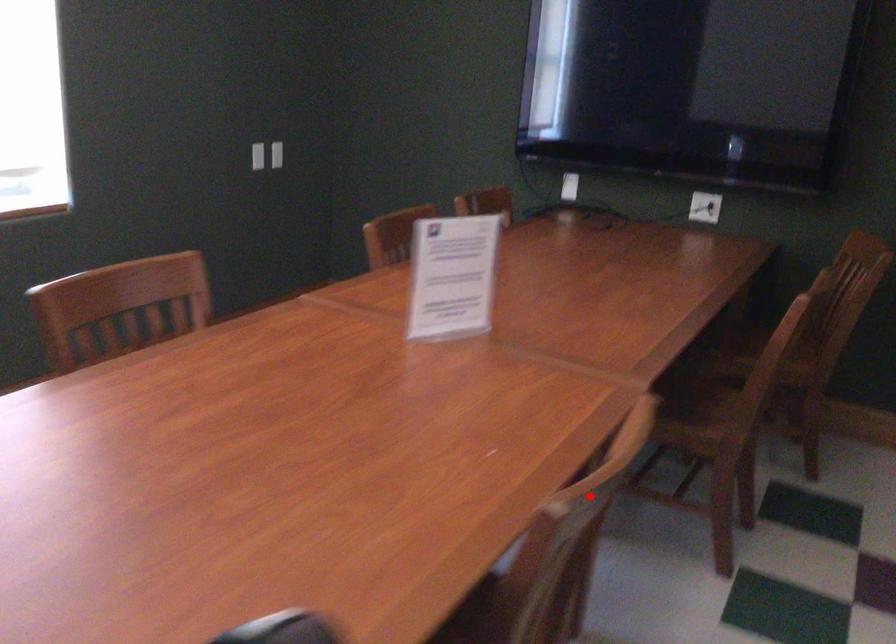
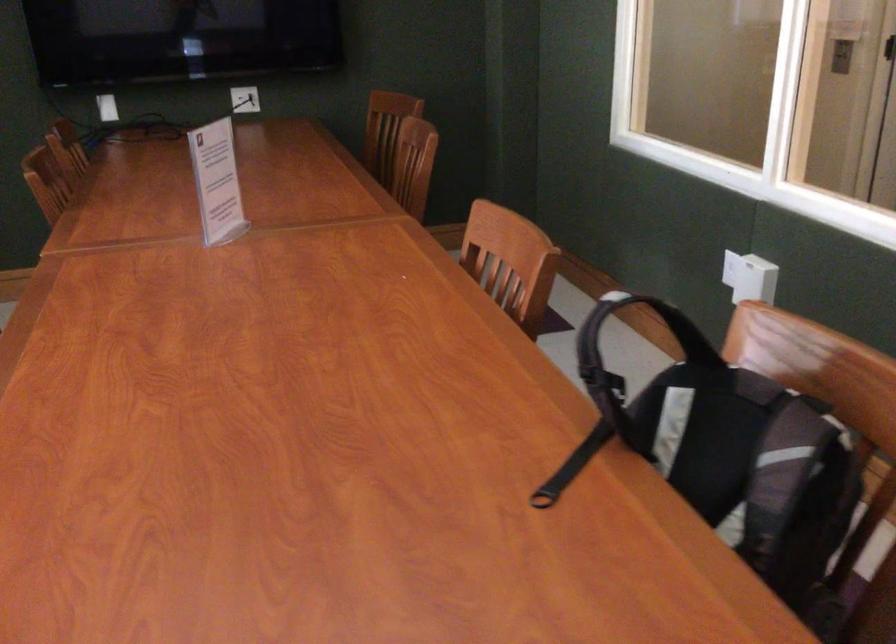
Question: A red point is marked in image1. In image2, is the corresponding 3D point closer to the camera or farther? Reply with the corresponding letter.

Choices:
 (A) The corresponding 3D point is closer.
 (B) The corresponding 3D point is farther.

Answer: (B)